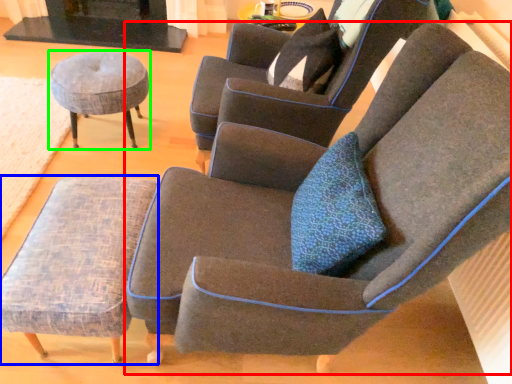
Question: Which is farther away from chair (highlighted by a red box)? stool (highlighted by a blue box) or stool (highlighted by a green box)?

Choices:
 (A) stool
 (B) stool

Answer: (B)